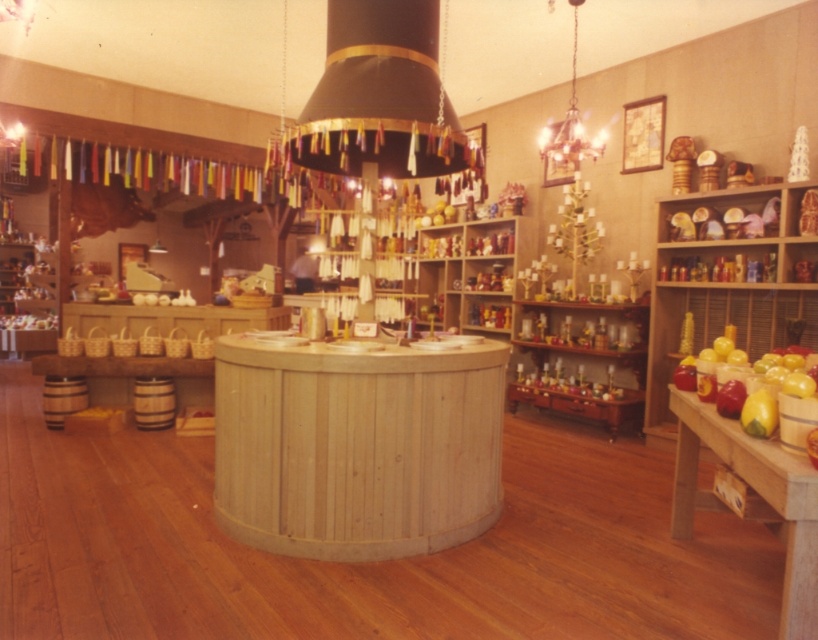
You are a customer standing at the entrance of the store. You want to place a small gift on the natural wood table at center and then hang a decorative light from the black fabric chandelier at upper center. Given that you can only move straight forward from your current position, will you be able to reach both items in sequence without needing to turn or adjust your path?

The natural wood table at center and black fabric chandelier at upper center are 1.29 meters apart. Since you can move straight forward, you can first reach the natural wood table at center to place the gift and then proceed to the black fabric chandelier at upper center to hang the light, as the distance between them allows sequential access in a straight path.

You are standing in the store and want to pick up an item from the counter. There are two points marked on the counter where items are placed. Which point is closer to you, point (324, 115) or point (722, 492)?

Point (324, 115) is closer to you because it is further to the camera than point (722, 492).

You are a customer in the store and want to place a small gift on the natural wood table at center without it being obstructed by the metallic chandelier at upper center. Is the height of the table sufficient to prevent the gift from being blocked?

The natural wood table at center has a lesser height compared to metallic chandelier at upper center, so the table is shorter than the chandelier. Therefore, placing the gift on the natural wood table at center won would not be obstructed by the metallic chandelier at upper center since the chandelier is taller and located above.